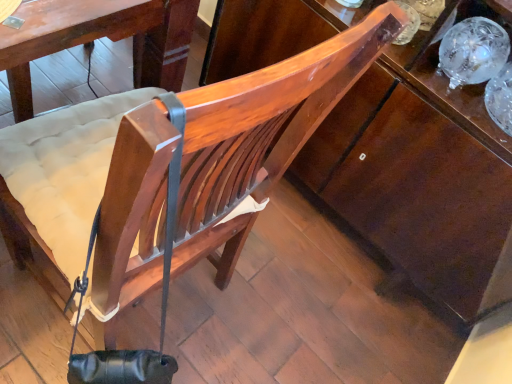
Question: Should I look upward or downward to see wooden chair at center?

Choices:
 (A) up
 (B) down

Answer: (A)